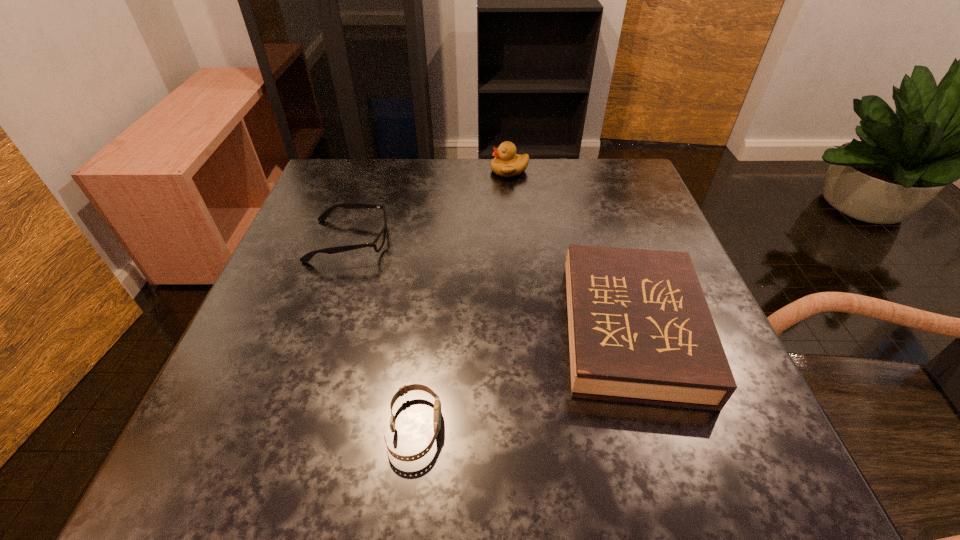
Locate an element on the screen. object that stands as the second closest to the tallest object is located at coordinates (640, 330).

The width and height of the screenshot is (960, 540). I want to click on vacant area that satisfies the following two spatial constraints: 1. on the front-facing side of the second farthest object; 2. on the left side of the hardback book, so click(320, 329).

Locate an element on the screen. The image size is (960, 540). free space in the image that satisfies the following two spatial constraints: 1. on the front-facing side of the spectacles; 2. on the left side of the hardback book is located at coordinates 320,329.

Identify the location of vacant position in the image that satisfies the following two spatial constraints: 1. at the beak of the third shortest object; 2. on the left side of the second object from right to left. (524, 329).

You are a GUI agent. You are given a task and a screenshot of the screen. Output one action in this format:
    pyautogui.click(x=<x>, y=<y>)
    Task: Click on the free space that satisfies the following two spatial constraints: 1. on the front-facing side of the second tallest object; 2. on the right side of the leftmost object
    The width and height of the screenshot is (960, 540).
    Given the screenshot: What is the action you would take?
    pyautogui.click(x=320, y=329)

I want to click on free space that satisfies the following two spatial constraints: 1. on the front-facing side of the leftmost object; 2. on the back side of the rightmost object, so click(320, 329).

Locate an element on the screen. This screenshot has height=540, width=960. vacant space that satisfies the following two spatial constraints: 1. at the beak of the third shortest object; 2. on the left side of the tallest object is located at coordinates (524, 329).

Where is `blank area in the image that satisfies the following two spatial constraints: 1. at the beak of the rightmost object; 2. on the left side of the duckling`? blank area in the image that satisfies the following two spatial constraints: 1. at the beak of the rightmost object; 2. on the left side of the duckling is located at coordinates (524, 329).

Image resolution: width=960 pixels, height=540 pixels. I want to click on vacant region that satisfies the following two spatial constraints: 1. at the beak of the tallest object; 2. on the right side of the hardback book, so click(524, 329).

The height and width of the screenshot is (540, 960). Identify the location of vacant space that satisfies the following two spatial constraints: 1. at the beak of the third shortest object; 2. on the right side of the farthest object. (524, 329).